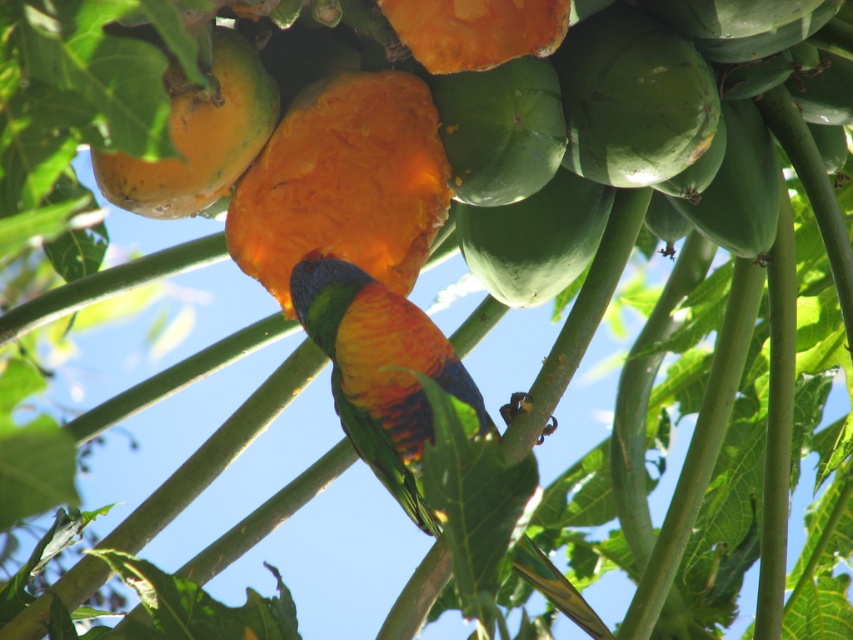
You are a photographer trying to capture the rainbow feathered parrot at center and the ripe papaya at center in a single shot. Since the parrot is on the right side of the papaya, where should you position your camera relative to the papaya to ensure both are in frame?

To capture both the rainbow feathered parrot at center and the ripe papaya at center in your photo, position your camera to the right side of the ripe papaya at center. This way, the parrot, which is already on the right side of the papaya, will be included in the frame along with the papaya.

You are a fruit seller who needs to arrange papayas by height. You have an orange matte papaya at center and a ripe papaya at center. Which papaya should you place on the lower shelf to accommodate their sizes?

The ripe papaya at center should be placed on the lower shelf because the orange matte papaya at center is taller and would require a higher shelf to accommodate its height.

You are a photographer trying to capture the colorful bird feeding on the ripe papaya. You notice two points in the scene marked as point 1 at coordinates (x=415, y=429) and point 2 at coordinates (x=262, y=93). Which point is closer to the camera?

Point 2 at coordinates (x=262, y=93) is closer to the camera than point 1 at coordinates (x=415, y=429).